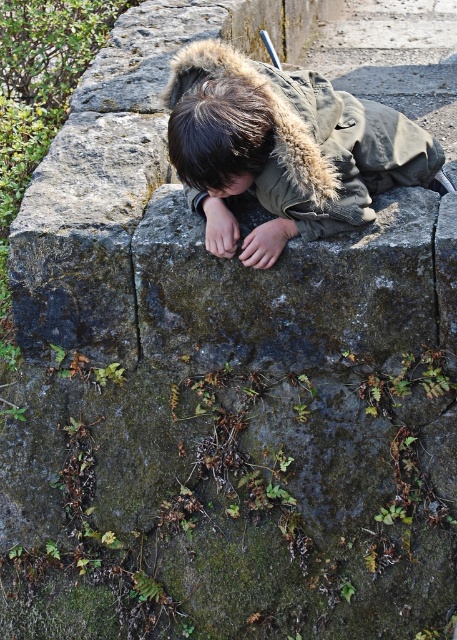
From the picture: The scene shows a child on a stone wall. There is a point labeled at coordinates (219, 134). What is located at that point?

The point at coordinates (219, 134) corresponds to the dark brown hair at center.